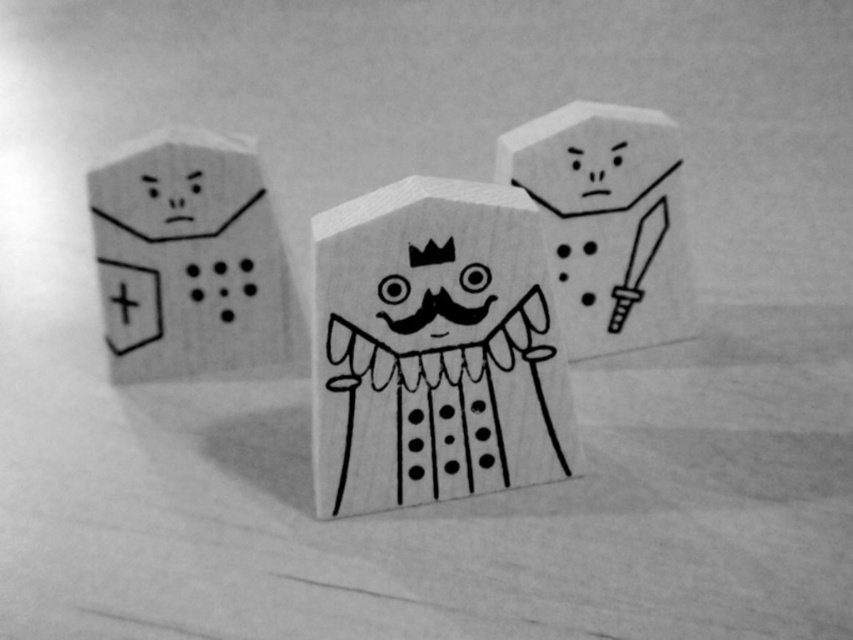
Question: Among these points, which one is nearest to the camera?

Choices:
 (A) (647, 246)
 (B) (421, 337)
 (C) (138, 200)

Answer: (B)

Question: Which of the following is the closest to the observer?

Choices:
 (A) (219, 232)
 (B) (543, 422)

Answer: (B)

Question: Which object is farther from the camera taking this photo?

Choices:
 (A) wooden king at center
 (B) wooden block at center
 (C) wooden block at left

Answer: (B)

Question: Is wooden block at left positioned in front of wooden block at center?

Choices:
 (A) yes
 (B) no

Answer: (A)

Question: From the image, what is the correct spatial relationship of wooden king at center in relation to wooden block at center?

Choices:
 (A) right
 (B) left

Answer: (B)

Question: Is wooden king at center bigger than wooden block at center?

Choices:
 (A) no
 (B) yes

Answer: (B)